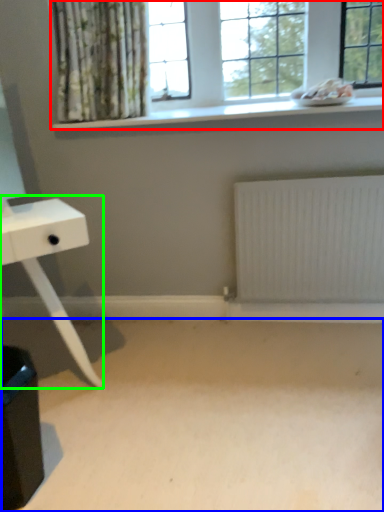
Question: Which object is positioned farthest from window (highlighted by a red box)? Select from plain (highlighted by a blue box) and table (highlighted by a green box).

Choices:
 (A) plain
 (B) table

Answer: (A)